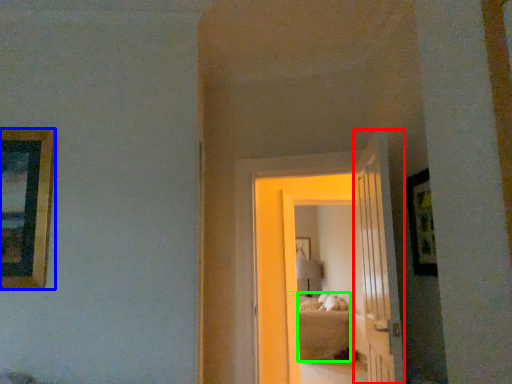
Question: Which object is positioned closest to door (highlighted by a red box)? Select from picture frame (highlighted by a blue box) and bed (highlighted by a green box).

Choices:
 (A) picture frame
 (B) bed

Answer: (A)